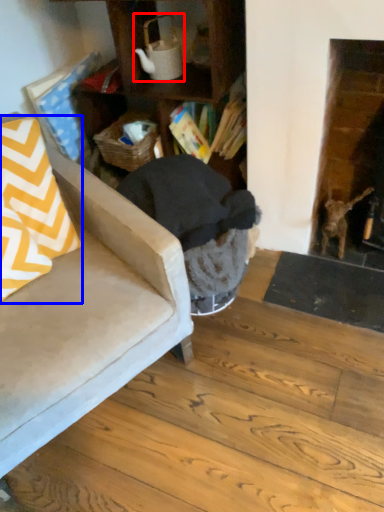
Question: Which point is further to the camera, tea pot (highlighted by a red box) or throw pillow (highlighted by a blue box)?

Choices:
 (A) tea pot
 (B) throw pillow

Answer: (A)